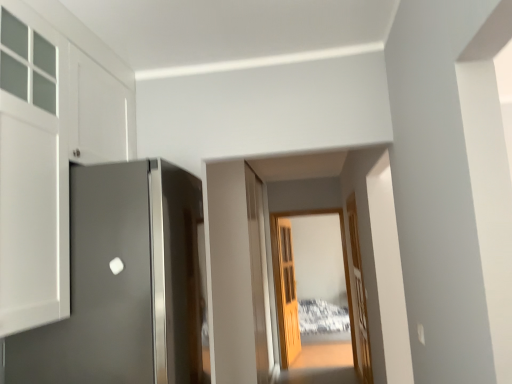
Question: Is light brown wooden door at center, marked as the second door in a left-to-right arrangement, inside the boundaries of transparent wooden door at center, or outside?

Choices:
 (A) inside
 (B) outside

Answer: (B)

Question: From the image's perspective, relative to transparent wooden door at center, is light brown wooden door at center, the 3th door in the front-to-back sequence, above or below?

Choices:
 (A) above
 (B) below

Answer: (B)

Question: Based on their relative distances, which object is nearer to the light brown wooden door at center, the 1th door when ordered from back to front?

Choices:
 (A) satin gray door at left, the 1th door in the front-to-back sequence
 (B) wooden door at center, which is the second door from front to back
 (C) transparent wooden door at center

Answer: (C)

Question: Based on their relative distances, which object is farther from the satin gray door at left, the third door in the back-to-front sequence?

Choices:
 (A) wooden door at center, the first door from the right
 (B) light brown wooden door at center, the 1th door when ordered from back to front
 (C) transparent wooden door at center

Answer: (B)